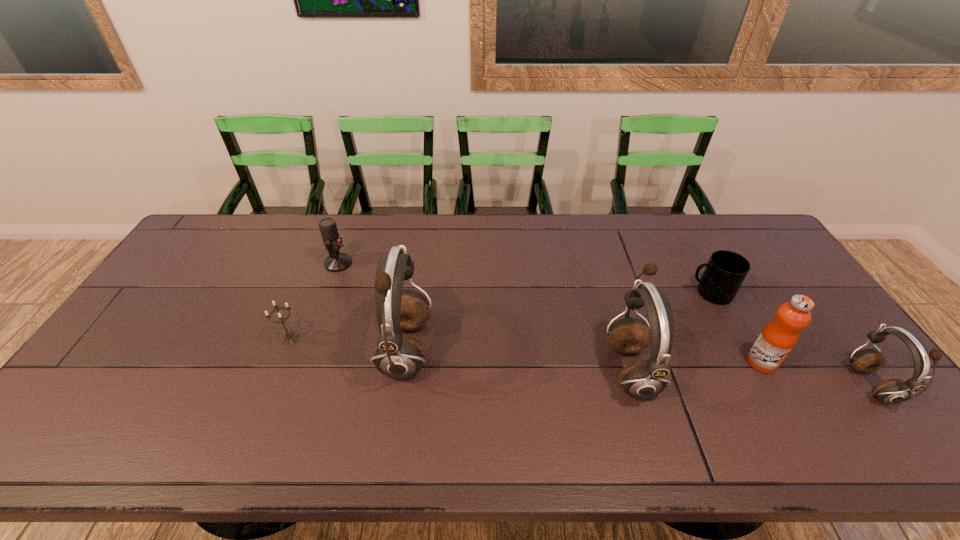
Identify the location of vacant space situated 0.390m on the ear pads of the fifth object from right to left. Image resolution: width=960 pixels, height=540 pixels. (575, 350).

This screenshot has width=960, height=540. I want to click on free space located on the ear pads of the second earphone from left to right, so click(x=565, y=368).

Locate an element on the screen. The width and height of the screenshot is (960, 540). vacant space located on the ear pads of the second earphone from left to right is located at coordinates (509, 368).

Identify the location of vacant space located on the ear pads of the second earphone from left to right. (463, 368).

This screenshot has height=540, width=960. I want to click on vacant point located on the side of the sixth nearest object with the handle, so click(x=635, y=293).

I want to click on blank space located on the side of the sixth nearest object with the handle, so click(x=583, y=293).

The image size is (960, 540). I want to click on free space located on the side of the sixth nearest object with the handle, so click(641, 293).

Image resolution: width=960 pixels, height=540 pixels. Find the location of `free region located 0.340m on the right of the candle holder`. free region located 0.340m on the right of the candle holder is located at coordinates (423, 340).

This screenshot has height=540, width=960. I want to click on vacant region located 0.260m on the side of the fifth tallest object with the red ring, so click(x=430, y=263).

Where is `vacant area situated 0.070m on the front label of the fruit juice`? vacant area situated 0.070m on the front label of the fruit juice is located at coordinates (781, 398).